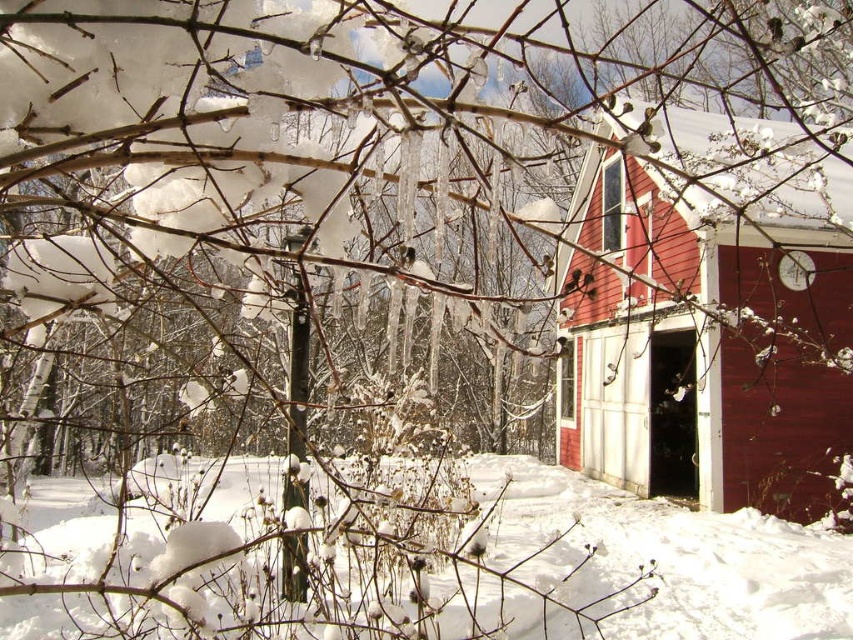
You are a photographer planning to take a winter landscape photo. You want to ensure that the smooth red cabin at center and the white fluffy snow at lower center are both clearly visible. Given their sizes, which object should you focus on first to ensure both are in focus?

The smooth red cabin at center is taller than the white fluffy snow at lower center. To ensure both are in focus, you should focus on the taller object first, which is the smooth red cabin at center, as it has more vertical space to capture.

From the picture: Based on the coordinates provided, which object is located at point (x=708, y=317)?

The point (x=708, y=317) marks the location of the smooth red cabin at center.